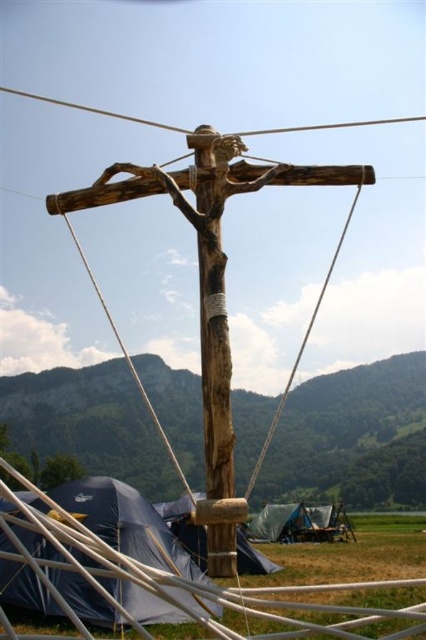
Question: Which point appears closest to the camera in this image?

Choices:
 (A) [60, 200]
 (B) [54, 554]

Answer: (A)

Question: Among these points, which one is nearest to the camera?

Choices:
 (A) (123, 593)
 (B) (247, 490)
 (C) (281, 566)
 (D) (230, 467)

Answer: (D)

Question: Which of the following is the closest to the observer?

Choices:
 (A) smooth wire at upper center
 (B) natural wood cross at center
 (C) blue fabric tent at lower left

Answer: (B)

Question: Is the position of natural wood cross at center less distant than that of blue fabric tent at lower left?

Choices:
 (A) no
 (B) yes

Answer: (B)

Question: Is blue fabric tent at center positioned before smooth wire at upper center?

Choices:
 (A) yes
 (B) no

Answer: (A)

Question: Can you confirm if natural wood cross at center is smaller than blue fabric tent at center?

Choices:
 (A) no
 (B) yes

Answer: (A)